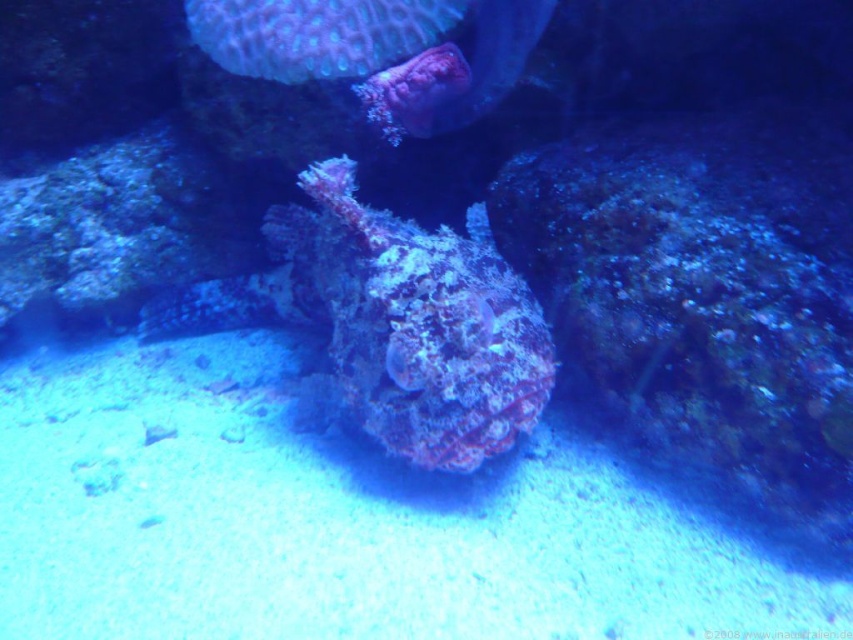
Consider the image. Measure the distance from speckled coral at center to smooth coral at upper center.

12.95 inches

Between point (397, 390) and point (451, 96), which one is positioned in front?

Point (397, 390)

Is point (466, 289) less distant than point (386, 132)?

Yes, point (466, 289) is in front of point (386, 132).

Where is `speckled coral at center`? Image resolution: width=853 pixels, height=640 pixels. speckled coral at center is located at coordinates (392, 321).

Does speckled coral at center appear over teal textured coral at upper center?

No.

Is point (476, 328) more distant than point (221, 33)?

No, it is in front of (221, 33).

Where is `speckled coral at center`? This screenshot has height=640, width=853. speckled coral at center is located at coordinates (392, 321).

In the scene shown: Does teal textured coral at upper center have a greater height compared to smooth coral at upper center?

In fact, teal textured coral at upper center may be shorter than smooth coral at upper center.

Who is taller, teal textured coral at upper center or smooth coral at upper center?

Standing taller between the two is smooth coral at upper center.

Is point (361, 32) behind point (509, 1)?

No, (361, 32) is closer to viewer.

Locate an element on the screen. The height and width of the screenshot is (640, 853). teal textured coral at upper center is located at coordinates point(316,35).